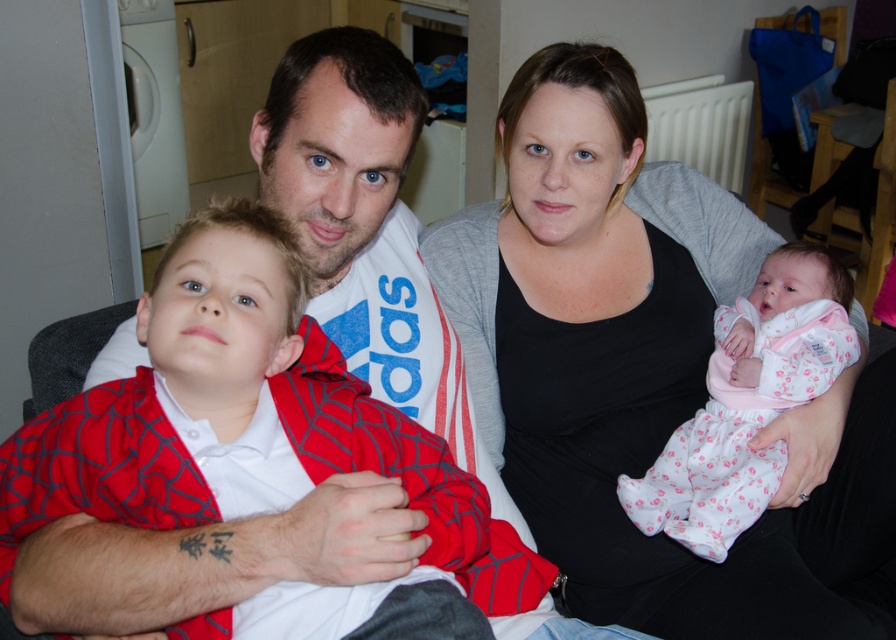
Does black matte tank top at center appear on the left side of pink fabric baby at center?

Yes, black matte tank top at center is to the left of pink fabric baby at center.

From the picture: Which is more to the left, black matte tank top at center or pink fabric baby at center?

black matte tank top at center

The height and width of the screenshot is (640, 896). I want to click on black matte tank top at center, so click(x=645, y=372).

Identify the location of black matte tank top at center. (645, 372).

Does matte red onesie at center have a smaller size compared to pink fabric baby at center?

Actually, matte red onesie at center might be larger than pink fabric baby at center.

Does matte red onesie at center appear on the right side of pink fabric baby at center?

Incorrect, matte red onesie at center is not on the right side of pink fabric baby at center.

The height and width of the screenshot is (640, 896). Identify the location of matte red onesie at center. (403, 486).

Between black matte tank top at center and matte red onesie at center, which one is positioned higher?

black matte tank top at center

Is point (485, 252) in front of point (522, 557)?

That is False.

The width and height of the screenshot is (896, 640). What do you see at coordinates (645, 372) in the screenshot?
I see `black matte tank top at center` at bounding box center [645, 372].

This screenshot has width=896, height=640. Identify the location of black matte tank top at center. 645,372.